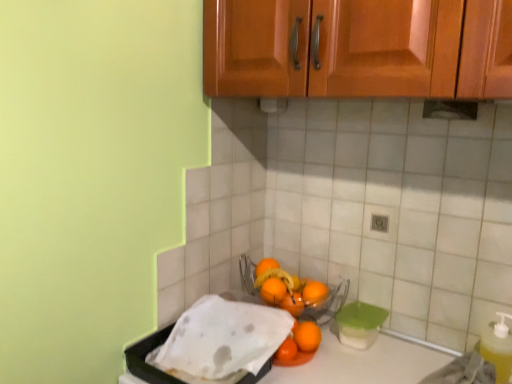
Question: From the image's perspective, is orange matte at lower center, the 1th orange in the top-to-bottom sequence, beneath orange matte at center, the third orange when ordered from top to bottom?

Choices:
 (A) no
 (B) yes

Answer: (A)

Question: Is orange matte at center, the third orange when ordered from top to bottom, a part of orange matte at lower center, positioned as the 5th orange in bottom-to-top order?

Choices:
 (A) yes
 (B) no

Answer: (B)

Question: Does orange matte at lower center, the 1th orange in the top-to-bottom sequence, have a lesser width compared to orange matte at center, the third orange when ordered from top to bottom?

Choices:
 (A) yes
 (B) no

Answer: (A)

Question: Considering the relative sizes of orange matte at lower center, the 1th orange in the top-to-bottom sequence, and orange matte at center, the third orange when ordered from bottom to top, in the image provided, is orange matte at lower center, the 1th orange in the top-to-bottom sequence, bigger than orange matte at center, the third orange when ordered from bottom to top,?

Choices:
 (A) no
 (B) yes

Answer: (B)

Question: From a real-world perspective, is orange matte at lower center, positioned as the 5th orange in bottom-to-top order, positioned over orange matte at center, the third orange when ordered from bottom to top, based on gravity?

Choices:
 (A) no
 (B) yes

Answer: (B)

Question: Is orange matte at center, placed as the second orange when sorted from top to bottom, bigger or smaller than yellow translucent bottle at lower right?

Choices:
 (A) big
 (B) small

Answer: (B)

Question: Is orange matte at center, placed as the second orange when sorted from top to bottom, to the left or to the right of yellow translucent bottle at lower right in the image?

Choices:
 (A) left
 (B) right

Answer: (A)

Question: Considering the positions of orange matte at center, the 4th orange when ordered from bottom to top, and yellow translucent bottle at lower right in the image, is orange matte at center, the 4th orange when ordered from bottom to top, taller or shorter than yellow translucent bottle at lower right?

Choices:
 (A) short
 (B) tall

Answer: (A)

Question: Considering the positions of point click(271, 296) and point click(481, 347), is point click(271, 296) closer or farther from the camera than point click(481, 347)?

Choices:
 (A) farther
 (B) closer

Answer: (A)

Question: Is orange matte at lower center, positioned as the 5th orange in bottom-to-top order, in front of or behind orange matte at lower right, which is the 5th orange in top-to-bottom order, in the image?

Choices:
 (A) behind
 (B) front

Answer: (A)

Question: From the image's perspective, is orange matte at lower center, positioned as the 5th orange in bottom-to-top order, positioned above or below orange matte at lower right, which is the 5th orange in top-to-bottom order?

Choices:
 (A) above
 (B) below

Answer: (A)

Question: Considering the positions of point (263, 266) and point (296, 331), is point (263, 266) closer or farther from the camera than point (296, 331)?

Choices:
 (A) closer
 (B) farther

Answer: (B)

Question: From a real-world perspective, is orange matte at lower center, positioned as the 5th orange in bottom-to-top order, above or below orange matte at lower right, which is the 5th orange in top-to-bottom order?

Choices:
 (A) above
 (B) below

Answer: (A)

Question: Is point (263, 309) closer or farther from the camera than point (287, 301)?

Choices:
 (A) farther
 (B) closer

Answer: (B)

Question: Do you think white paper towel at lower left, the first wash viewed from the left, is within orange matte at center, marked as the 4th orange in a top-to-bottom arrangement, or outside of it?

Choices:
 (A) inside
 (B) outside

Answer: (B)